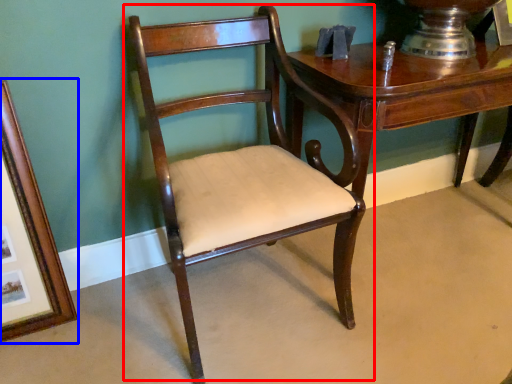
Question: Which of the following is the closest to the observer, chair (highlighted by a red box) or picture frame (highlighted by a blue box)?

Choices:
 (A) chair
 (B) picture frame

Answer: (A)